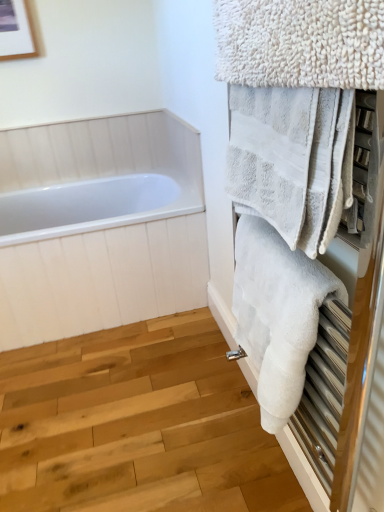
Question: Considering the relative sizes of white fluffy towel at upper right, the 2th towel from the top, and white fluffy towel at upper right, placed as the first towel when sorted from top to bottom, in the image provided, is white fluffy towel at upper right, the 2th towel from the top, taller than white fluffy towel at upper right, placed as the first towel when sorted from top to bottom,?

Choices:
 (A) no
 (B) yes

Answer: (B)

Question: Can you confirm if white fluffy towel at upper right, the 2th towel from the top, is shorter than white fluffy towel at upper right, placed as the first towel when sorted from top to bottom?

Choices:
 (A) yes
 (B) no

Answer: (B)

Question: Are white fluffy towel at upper right, the 2th towel from the top, and white fluffy towel at upper right, marked as the third towel in a bottom-to-top arrangement, located far from each other?

Choices:
 (A) no
 (B) yes

Answer: (A)

Question: Is white fluffy towel at upper right, marked as the second towel in a bottom-to-top arrangement, oriented towards white fluffy towel at upper right, placed as the first towel when sorted from top to bottom?

Choices:
 (A) no
 (B) yes

Answer: (A)

Question: Is white fluffy towel at upper right, the 2th towel from the top, facing away from white fluffy towel at upper right, marked as the third towel in a bottom-to-top arrangement?

Choices:
 (A) yes
 (B) no

Answer: (B)

Question: Is white fluffy towel at upper right, placed as the first towel when sorted from top to bottom, located within white fluffy towel at upper right, marked as the second towel in a bottom-to-top arrangement?

Choices:
 (A) yes
 (B) no

Answer: (B)

Question: Is there a large distance between white fluffy towel at upper right, the 2th towel from the top, and white fluffy towel at right, marked as the 3th towel in a top-to-bottom arrangement?

Choices:
 (A) no
 (B) yes

Answer: (A)

Question: From the image's perspective, is white fluffy towel at upper right, marked as the second towel in a bottom-to-top arrangement, below white fluffy towel at right, marked as the 3th towel in a top-to-bottom arrangement?

Choices:
 (A) no
 (B) yes

Answer: (A)

Question: Can you confirm if white fluffy towel at upper right, marked as the second towel in a bottom-to-top arrangement, is taller than white fluffy towel at right, marked as the 3th towel in a top-to-bottom arrangement?

Choices:
 (A) no
 (B) yes

Answer: (A)

Question: Does white fluffy towel at upper right, the 2th towel from the top, have a greater width compared to white fluffy towel at right, marked as the 3th towel in a top-to-bottom arrangement?

Choices:
 (A) no
 (B) yes

Answer: (A)

Question: Is white fluffy towel at right, placed as the 1th towel when sorted from bottom to top, at the back of white fluffy towel at upper right, marked as the second towel in a bottom-to-top arrangement?

Choices:
 (A) yes
 (B) no

Answer: (B)

Question: Considering the relative sizes of white fluffy towel at upper right, marked as the second towel in a bottom-to-top arrangement, and white fluffy towel at right, placed as the 1th towel when sorted from bottom to top, in the image provided, is white fluffy towel at upper right, marked as the second towel in a bottom-to-top arrangement, shorter than white fluffy towel at right, placed as the 1th towel when sorted from bottom to top,?

Choices:
 (A) no
 (B) yes

Answer: (B)

Question: From a real-world perspective, is white fluffy towel at right, marked as the 3th towel in a top-to-bottom arrangement, positioned under white fluffy towel at upper right, placed as the first towel when sorted from top to bottom, based on gravity?

Choices:
 (A) no
 (B) yes

Answer: (B)